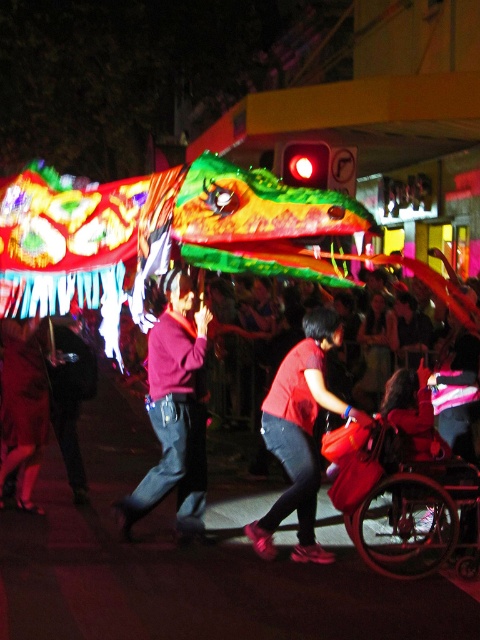
Question: Which object appears closest to the camera in this image?

Choices:
 (A) metallic red wheelchair at lower right
 (B) matte red sweater at center
 (C) matte red shirt at center

Answer: (A)

Question: Which point is farther from the camera taking this photo?

Choices:
 (A) (130, 532)
 (B) (380, 552)
 (C) (384, 364)

Answer: (C)

Question: Does matte red sweater at center have a lesser width compared to matte red shirt at center?

Choices:
 (A) no
 (B) yes

Answer: (A)

Question: Which point is farther from the camera taking this photo?

Choices:
 (A) (152, 330)
 (B) (363, 384)
 (C) (404, 564)

Answer: (B)

Question: Is metallic red wheelchair at lower right to the left of matte red shirt at center from the viewer's perspective?

Choices:
 (A) no
 (B) yes

Answer: (B)

Question: Can you confirm if matte red sweater at center is wider than matte red shirt at center?

Choices:
 (A) yes
 (B) no

Answer: (A)